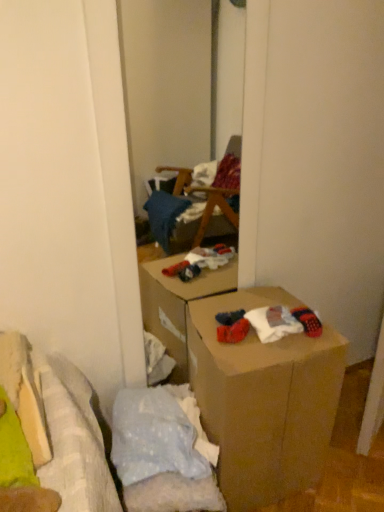
Measure the distance between knitted wool socks at lower right and camera.

knitted wool socks at lower right and camera are 1.26 meters apart.

What do you see at coordinates (308, 321) in the screenshot? I see `knitted wool socks at lower right` at bounding box center [308, 321].

Find the location of `knitted wool socks at lower right`. knitted wool socks at lower right is located at coordinates (308, 321).

Describe the element at coordinates (264, 399) in the screenshot. I see `brown cardboard box at center` at that location.

Find the location of a particular element. brown cardboard box at center is located at coordinates click(264, 399).

This screenshot has height=512, width=384. Identify the location of knitted wool socks at lower right. (308, 321).

Is brown cardboard box at center at the left side of knitted wool socks at lower right?

Yes, brown cardboard box at center is to the left of knitted wool socks at lower right.

Between brown cardboard box at center and knitted wool socks at lower right, which one is positioned in front?

brown cardboard box at center is more forward.

Is point (269, 364) positioned before point (297, 316)?

Yes, point (269, 364) is closer to viewer.

Looking at this image, from the image's perspective, who appears lower, brown cardboard box at center or knitted wool socks at lower right?

brown cardboard box at center is shown below in the image.

From a real-world perspective, is brown cardboard box at center on knitted wool socks at lower right?

No, from a real-world perspective, brown cardboard box at center is not on top of knitted wool socks at lower right.

Considering the sizes of objects brown cardboard box at center and knitted wool socks at lower right in the image provided, who is wider, brown cardboard box at center or knitted wool socks at lower right?

brown cardboard box at center.

Consider the image. Does brown cardboard box at center have a greater height compared to knitted wool socks at lower right?

Correct, brown cardboard box at center is much taller as knitted wool socks at lower right.

Considering the relative sizes of brown cardboard box at center and knitted wool socks at lower right in the image provided, is brown cardboard box at center smaller than knitted wool socks at lower right?

No, brown cardboard box at center is not smaller than knitted wool socks at lower right.

Is brown cardboard box at center positioned beyond the bounds of knitted wool socks at lower right?

brown cardboard box at center lies outside knitted wool socks at lower right's area.

Would you say brown cardboard box at center is a long distance from knitted wool socks at lower right?

brown cardboard box at center is actually quite close to knitted wool socks at lower right.

Could you tell me if brown cardboard box at center is facing knitted wool socks at lower right?

No, brown cardboard box at center is not oriented towards knitted wool socks at lower right.

How many degrees apart are the facing directions of brown cardboard box at center and knitted wool socks at lower right?

The facing directions of brown cardboard box at center and knitted wool socks at lower right are 1.43 degrees apart.

How distant is brown cardboard box at center from knitted wool socks at lower right?

They are 11.33 inches apart.

Find the location of a particular element. The width and height of the screenshot is (384, 512). toy above the brown cardboard box at center (from the image's perspective) is located at coordinates click(308, 321).

Can you confirm if knitted wool socks at lower right is positioned to the left of brown cardboard box at center?

In fact, knitted wool socks at lower right is to the right of brown cardboard box at center.

Which object is closer to the camera, knitted wool socks at lower right or brown cardboard box at center?

brown cardboard box at center is more forward.

Considering the points (296, 312) and (230, 510), which point is in front, point (296, 312) or point (230, 510)?

Positioned in front is point (296, 312).

From the image's perspective, is knitted wool socks at lower right located above or below brown cardboard box at center?

Based on their image positions, knitted wool socks at lower right is located above brown cardboard box at center.

Based on the photo, from a real-world perspective, which object stands above the other?

From a 3D spatial view, knitted wool socks at lower right is above.

Is knitted wool socks at lower right wider or thinner than brown cardboard box at center?

Considering their sizes, knitted wool socks at lower right looks slimmer than brown cardboard box at center.

Between knitted wool socks at lower right and brown cardboard box at center, which one has more height?

brown cardboard box at center is taller.

Consider the image. Looking at the image, does knitted wool socks at lower right seem bigger or smaller compared to brown cardboard box at center?

In the image, knitted wool socks at lower right appears to be smaller than brown cardboard box at center.

Do you think knitted wool socks at lower right is within brown cardboard box at center, or outside of it?

knitted wool socks at lower right is contained in brown cardboard box at center.

Is knitted wool socks at lower right positioned far away from brown cardboard box at center?

knitted wool socks at lower right is actually quite close to brown cardboard box at center.

Could you tell me if knitted wool socks at lower right is turned towards brown cardboard box at center?

Yes, knitted wool socks at lower right is aimed at brown cardboard box at center.

Can you tell me how much knitted wool socks at lower right and brown cardboard box at center differ in facing direction?

The angle between the facing direction of knitted wool socks at lower right and the facing direction of brown cardboard box at center is 1.43 degrees.

You are a GUI agent. You are given a task and a screenshot of the screen. Output one action in this format:
    pyautogui.click(x=<x>, y=<y>)
    Task: Click on the box beneath the knitted wool socks at lower right (from a real-world perspective)
    This screenshot has width=384, height=512.
    Given the screenshot: What is the action you would take?
    pyautogui.click(x=264, y=399)

You are a GUI agent. You are given a task and a screenshot of the screen. Output one action in this format:
    pyautogui.click(x=<x>, y=<y>)
    Task: Click on the toy behind the brown cardboard box at center
    This screenshot has height=512, width=384.
    Given the screenshot: What is the action you would take?
    pyautogui.click(x=308, y=321)

This screenshot has width=384, height=512. I want to click on box below the knitted wool socks at lower right (from a real-world perspective), so click(x=264, y=399).